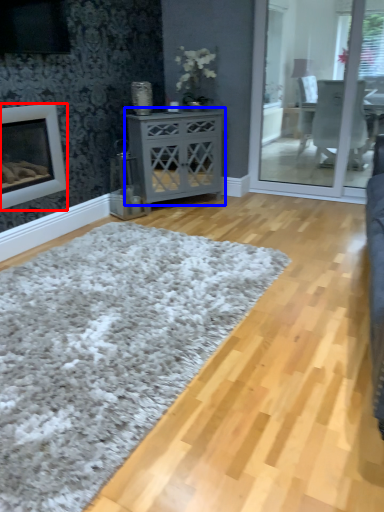
Question: Which object is closer to the camera taking this photo, fireplace (highlighted by a red box) or nightstand (highlighted by a blue box)?

Choices:
 (A) fireplace
 (B) nightstand

Answer: (A)